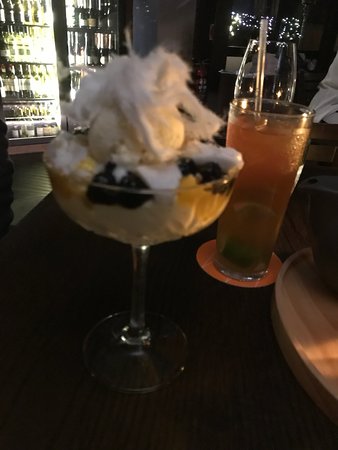
Find the location of a particular element. orange coaster is located at coordinates (213, 270).